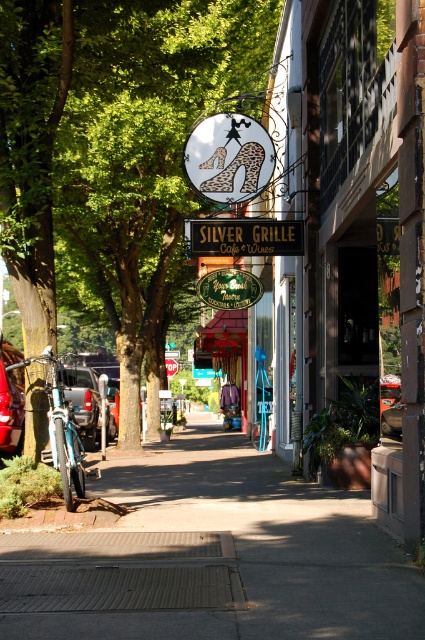
Which is more to the left, green leafy tree at center or metallic silver car at center?

Positioned to the left is metallic silver car at center.

This screenshot has width=425, height=640. Describe the element at coordinates (110, 145) in the screenshot. I see `green leafy tree at center` at that location.

Image resolution: width=425 pixels, height=640 pixels. What are the coordinates of `green leafy tree at center` in the screenshot? It's located at (110, 145).

Find the location of a particular element. green leafy tree at center is located at coordinates (110, 145).

Based on the photo, is green leafy tree at center wider than matte silver suv at left?

Indeed, green leafy tree at center has a greater width compared to matte silver suv at left.

Can you confirm if green leafy tree at center is positioned to the right of matte silver suv at left?

Indeed, green leafy tree at center is positioned on the right side of matte silver suv at left.

The height and width of the screenshot is (640, 425). In order to click on green leafy tree at center in this screenshot , I will do `click(110, 145)`.

Identify the location of green leafy tree at center. The image size is (425, 640). 110,145.

Which of these two, gold metallic sign at center or metallic silver car at left, stands taller?

Standing taller between the two is metallic silver car at left.

Does gold metallic sign at center lie behind metallic silver car at left?

No, it is not.

At what (x,y) coordinates should I click in order to perform the action: click on gold metallic sign at center. Please return your answer as a coordinate pair (x, y). The width and height of the screenshot is (425, 640). Looking at the image, I should click on (246, 236).